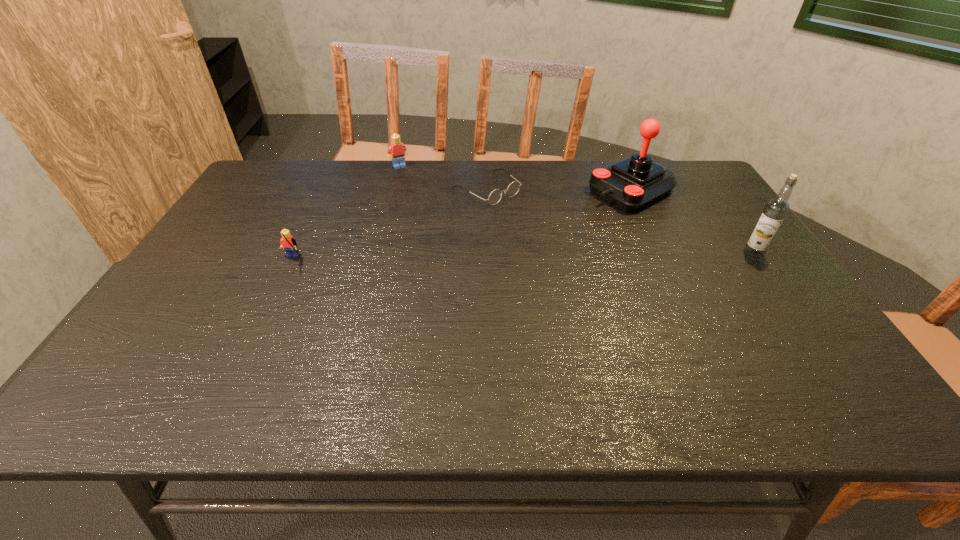
The image size is (960, 540). What are the coordinates of `the left Lego` in the screenshot? It's located at (288, 243).

What are the coordinates of `the leftmost object` in the screenshot? It's located at (288, 243).

The image size is (960, 540). I want to click on vodka, so click(776, 209).

Find the location of `spectacles`. spectacles is located at coordinates (495, 196).

The width and height of the screenshot is (960, 540). Find the location of `the third object from right to left`. the third object from right to left is located at coordinates (495, 196).

Locate an element on the screen. the second object from left to right is located at coordinates [x=397, y=151].

This screenshot has width=960, height=540. Identify the location of the farther Lego. (397, 151).

Where is `the second object from right to left`? the second object from right to left is located at coordinates (631, 184).

Find the location of a particular element. The image size is (960, 540). vacant space located on the front-facing side of the leftmost object is located at coordinates pos(257,332).

Image resolution: width=960 pixels, height=540 pixels. What are the coordinates of `free space located 0.220m on the label of the rightmost object` in the screenshot? It's located at (663, 253).